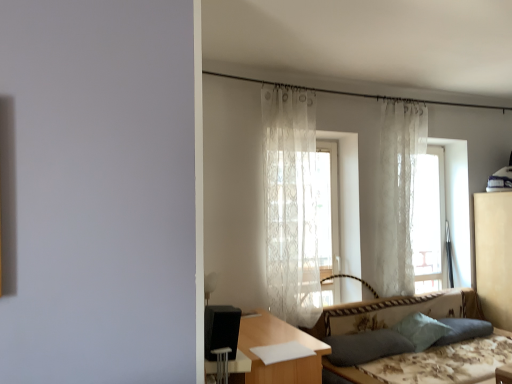
Question: From the image's perspective, is beige fabric dresser at right over translucent white curtain at center?

Choices:
 (A) yes
 (B) no

Answer: (B)

Question: Is beige fabric dresser at right oriented away from translucent white curtain at center?

Choices:
 (A) no
 (B) yes

Answer: (A)

Question: From a real-world perspective, is beige fabric dresser at right beneath translucent white curtain at center?

Choices:
 (A) no
 (B) yes

Answer: (B)

Question: Can you confirm if beige fabric dresser at right is shorter than translucent white curtain at center?

Choices:
 (A) no
 (B) yes

Answer: (A)

Question: From the image's perspective, would you say beige fabric dresser at right is shown under translucent white curtain at center?

Choices:
 (A) yes
 (B) no

Answer: (A)

Question: In terms of height, does translucent white curtain at center look taller or shorter compared to wooden table at center?

Choices:
 (A) tall
 (B) short

Answer: (A)

Question: From a real-world perspective, relative to wooden table at center, is translucent white curtain at center vertically above or below?

Choices:
 (A) above
 (B) below

Answer: (A)

Question: Considering the relative positions of translucent white curtain at center and wooden table at center in the image provided, is translucent white curtain at center to the left or to the right of wooden table at center?

Choices:
 (A) right
 (B) left

Answer: (A)

Question: In the image, is translucent white curtain at center positioned in front of or behind wooden table at center?

Choices:
 (A) front
 (B) behind

Answer: (B)

Question: Is light blue fabric pillow at lower right, acting as the third pillow starting from the left, in front of or behind wooden table at center in the image?

Choices:
 (A) behind
 (B) front

Answer: (A)

Question: Is point (458, 339) closer or farther from the camera than point (250, 314)?

Choices:
 (A) closer
 (B) farther

Answer: (B)

Question: From their relative heights in the image, would you say light blue fabric pillow at lower right, acting as the third pillow starting from the left, is taller or shorter than wooden table at center?

Choices:
 (A) tall
 (B) short

Answer: (B)

Question: Considering the relative positions of light blue fabric pillow at lower right, acting as the third pillow starting from the left, and wooden table at center in the image provided, is light blue fabric pillow at lower right, acting as the third pillow starting from the left, to the left or to the right of wooden table at center?

Choices:
 (A) left
 (B) right

Answer: (B)

Question: Considering the positions of translucent white curtain at center and beige fabric dresser at right in the image, is translucent white curtain at center wider or thinner than beige fabric dresser at right?

Choices:
 (A) thin
 (B) wide

Answer: (A)

Question: Is point (347, 173) positioned closer to the camera than point (502, 294)?

Choices:
 (A) farther
 (B) closer

Answer: (B)